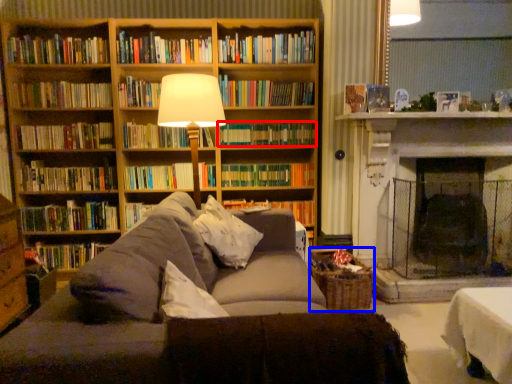
Question: Which point is closer to the camera, book (highlighted by a red box) or basket (highlighted by a blue box)?

Choices:
 (A) book
 (B) basket

Answer: (B)